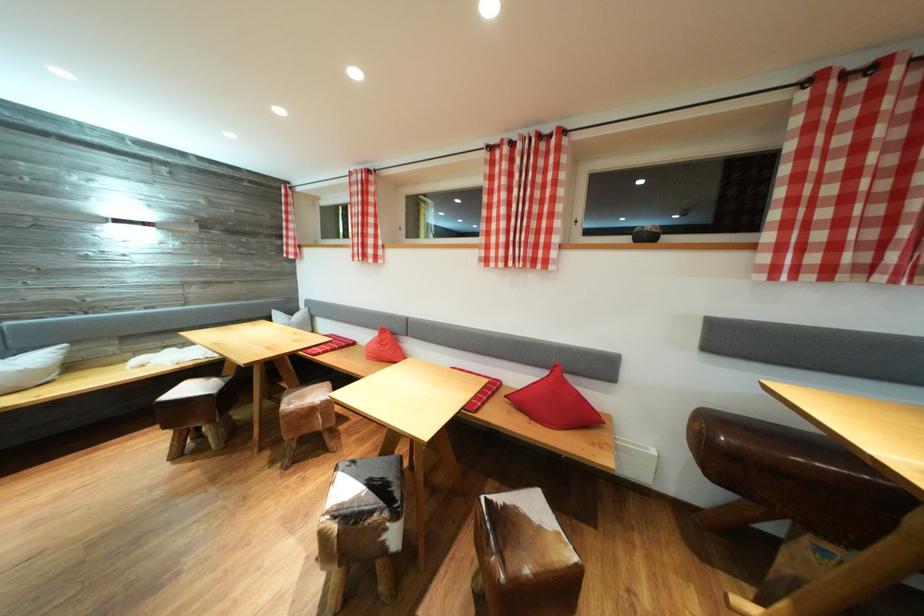
What do you see at coordinates (31, 368) in the screenshot?
I see `the wooden bench surface` at bounding box center [31, 368].